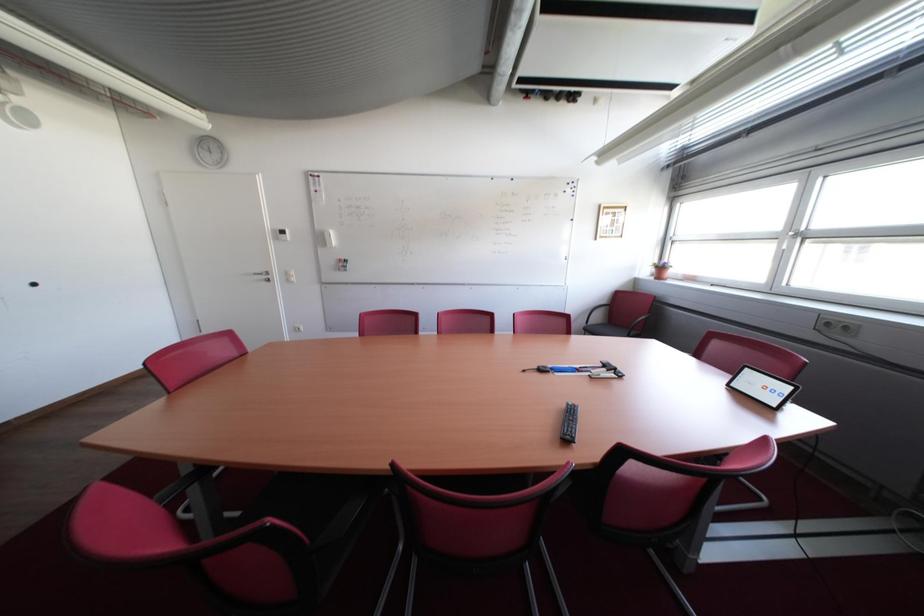
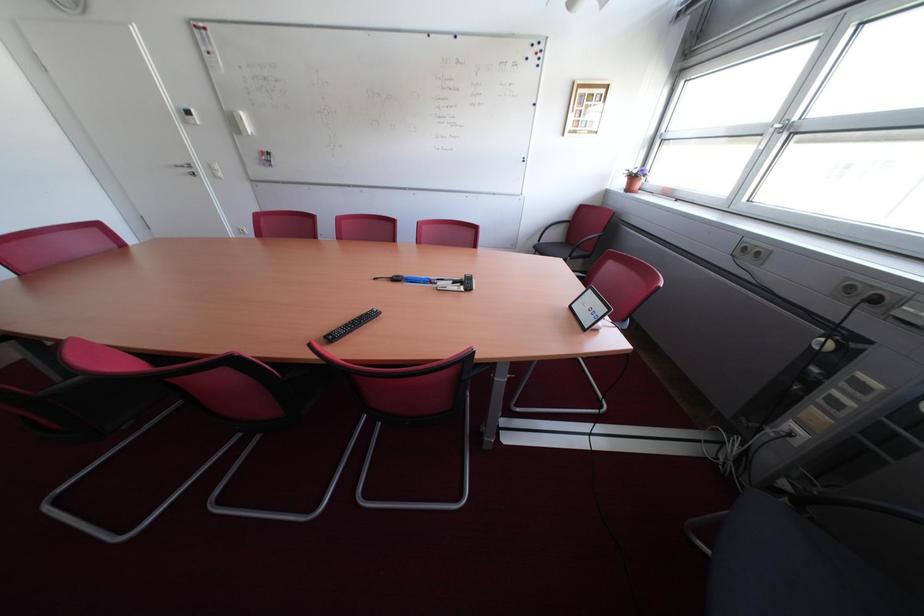
Question: In a continuous first-person perspective shot, in which direction is the camera moving?

Choices:
 (A) Left
 (B) Right
 (C) Forward
 (D) Backward

Answer: (B)